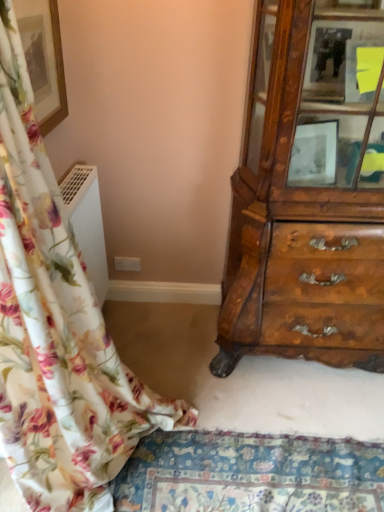
This screenshot has height=512, width=384. Identify the location of free space in front of wooden cabinet at right. (305, 407).